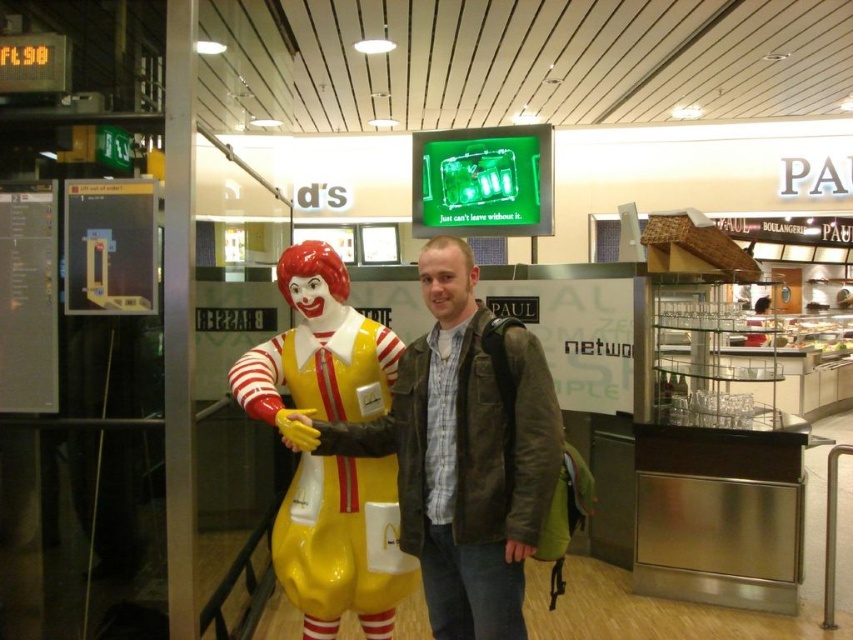
You are a photographer trying to capture a photo of the yellow glossy clown at center and the brown leather jacket at center. Which object should you focus on first if you want to include both in the frame without moving the camera?

The brown leather jacket at center is not as tall as the yellow glossy clown at center, so you should focus on the taller yellow glossy clown at center first to ensure it fits within the frame.

You are a photographer trying to capture both the brown leather jacket at center and the yellow glossy clown at center in a single frame. Which object should you focus on first to ensure both are in the frame without moving the camera?

The brown leather jacket at center is bigger than the yellow glossy clown at center, so you should focus on the brown leather jacket at center first to ensure both fit within the frame.

You are a photographer taking a picture of the brown leather jacket at center and the yellow glossy clown at center. Which object should you focus on first if you want to capture both in sharp focus?

The brown leather jacket at center is above the yellow glossy clown at center, so focusing on the clown first will keep both in focus as they are vertically aligned.